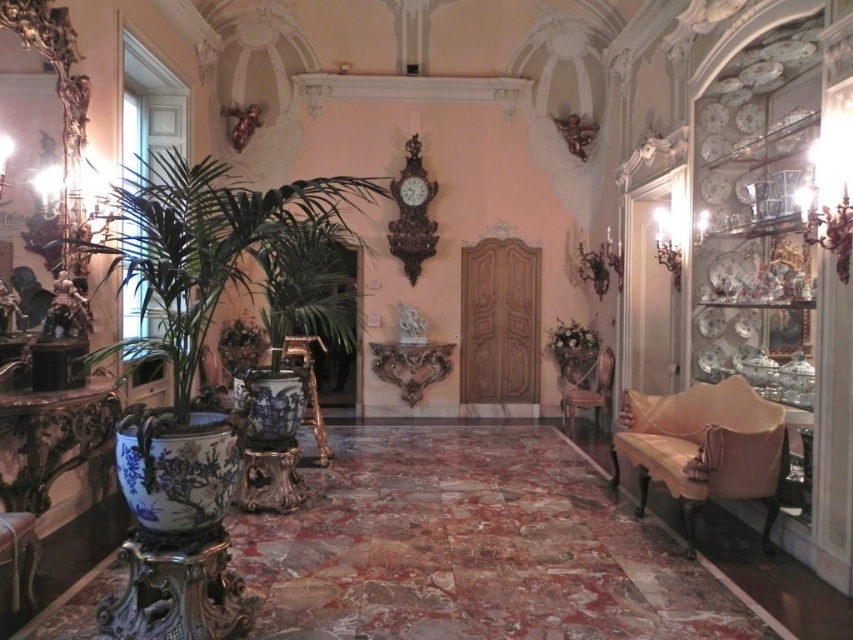
Is velvet beige armchair at right wider than wooden armchair at right?

Correct, the width of velvet beige armchair at right exceeds that of wooden armchair at right.

Is velvet beige armchair at right above wooden armchair at right?

Incorrect, velvet beige armchair at right is not positioned above wooden armchair at right.

Is point (648, 458) in front of point (582, 378)?

Yes, it is in front of point (582, 378).

Find the location of a particular element. velvet beige armchair at right is located at coordinates (704, 445).

Is point (293, 337) more distant than point (606, 397)?

No, (293, 337) is in front of (606, 397).

Who is shorter, gold polished wood armchair at center or wooden armchair at right?

Standing shorter between the two is wooden armchair at right.

The width and height of the screenshot is (853, 640). I want to click on gold polished wood armchair at center, so click(x=306, y=387).

Who is more distant from viewer, (328, 205) or (321, 419)?

The point (328, 205) is behind.

Between point (305, 188) and point (312, 385), which one is positioned in front?

Point (305, 188) is in front.

Locate an element on the screen. blue glazed pot at left is located at coordinates (202, 248).